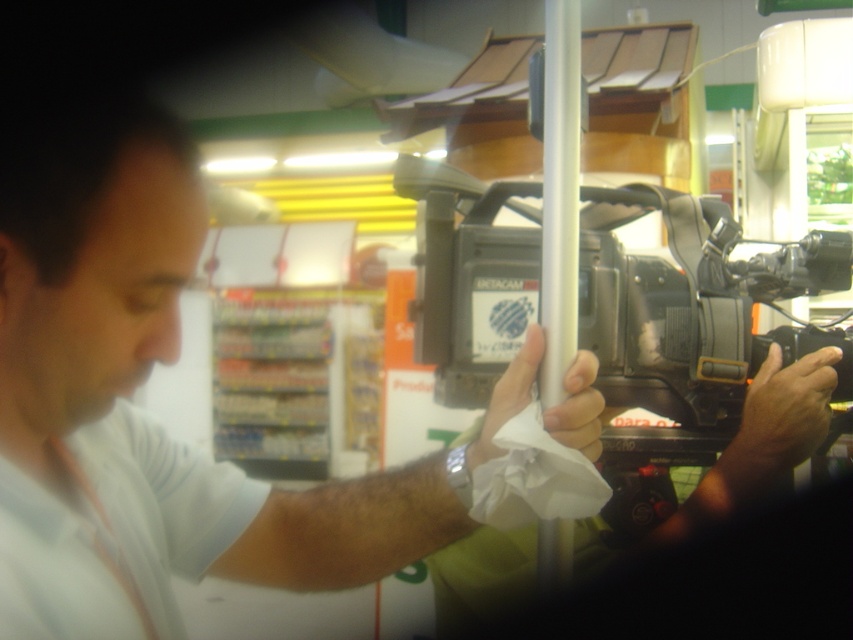
You are a photographer trying to capture a closeup of the white matte paper towel at center in a convenience store. The smooth skin hand at center is blocking your view. Can you move the hand to the side to get a clear shot?

The smooth skin hand at center is below the white matte paper towel at center, so moving the hand upwards would allow you to capture the paper towel without obstruction.

You are a photographer trying to capture a product shot of the white matte paper towel at center. The black plastic video camera at center is blocking your view. Can you move the camera to the side without moving the paper towel? Explain why or why not based on their sizes.

The black plastic video camera at center is taller than the white matte paper towel at center. Since the camera is taller, it might be physically larger and harder to move out of the way compared to the smaller paper towel. However, whether you can move it depends on its weight and stability, not just height. The description only mentions height, so we cannot confirm if it can be moved based on size alone.

You are a photographer in a convenience store. You see a smooth skin hand at center and a white matte paper towel at center. Which object is positioned to the right?

Result: The smooth skin hand at center is to the right of the white matte paper towel at center.